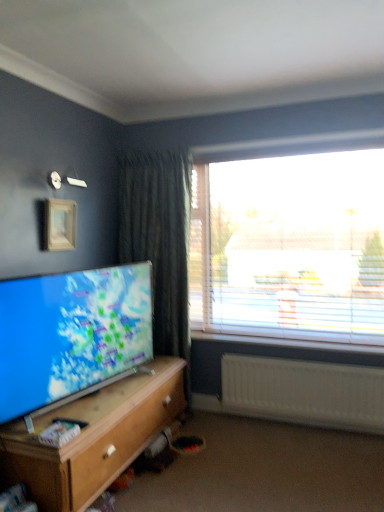
I want to click on vacant space underneath white plastic radiator at lower right (from a real-world perspective), so click(x=292, y=421).